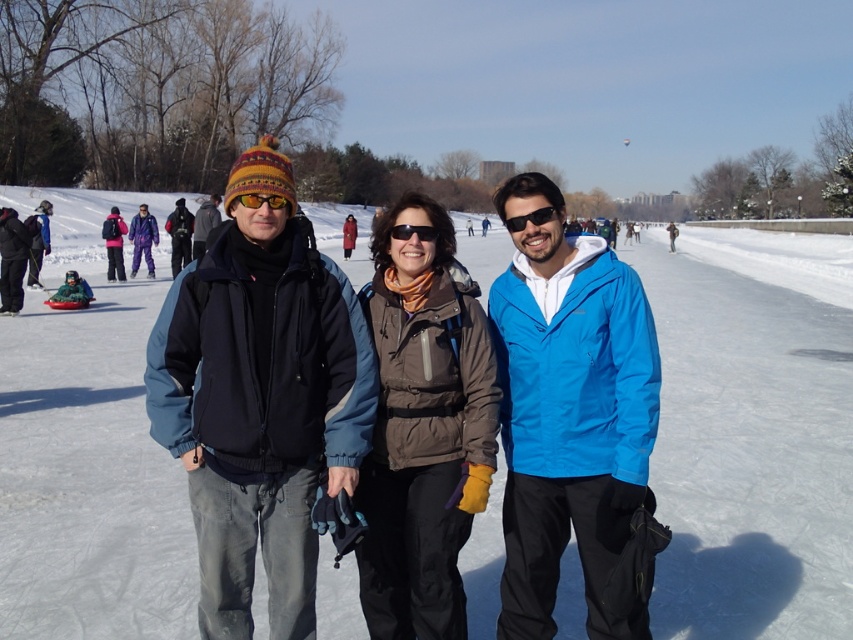
Is blue fabric jacket at center positioned at the back of black plastic sunglasses at center?

No, it is in front of black plastic sunglasses at center.

Who is more forward, (508,630) or (425,230)?

Point (425,230) is in front.

Identify the location of blue fabric jacket at center. The height and width of the screenshot is (640, 853). (569, 413).

Who is more forward, (181, 204) or (140, 220)?

Point (181, 204) is in front.

From the picture: Is matte black jacket at center above purple fleece jacket at center?

Incorrect, matte black jacket at center is not positioned above purple fleece jacket at center.

Who is more distant from viewer, (183, 211) or (149, 220)?

The point (149, 220) is more distant.

Locate an element on the screen. This screenshot has height=640, width=853. matte black jacket at center is located at coordinates (178, 236).

Between point (223, 336) and point (212, 216), which one is positioned behind?

Point (212, 216)

Which is above, matte blue jacket at center or dark gray jacket at center?

Positioned higher is dark gray jacket at center.

Find the location of `matte blue jacket at center`. matte blue jacket at center is located at coordinates (260, 401).

You are a GUI agent. You are given a task and a screenshot of the screen. Output one action in this format:
    pyautogui.click(x=<x>, y=<y>)
    Task: Click on the matte blue jacket at center
    Image resolution: width=853 pixels, height=640 pixels.
    Given the screenshot: What is the action you would take?
    pyautogui.click(x=260, y=401)